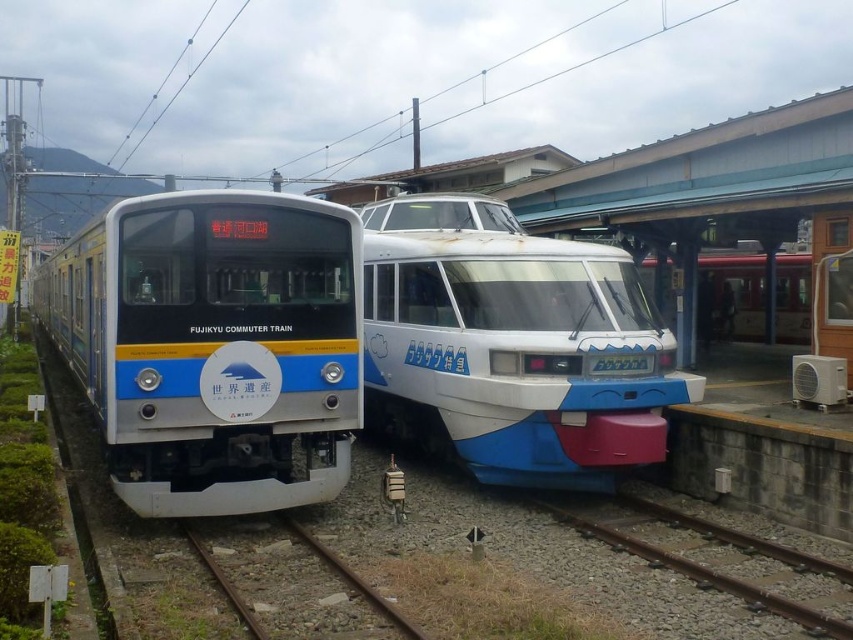
You are standing at the train station and want to board the blue glossy train at center. According to the coordinates provided, where exactly should you go to board it?

The blue glossy train at center is located at coordinates point (512, 344), so you should go to that point to board it.